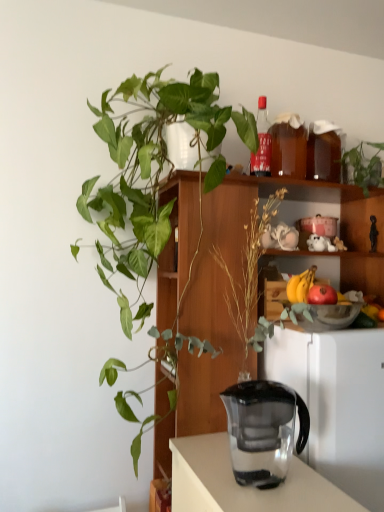
Locate an element on the screen. The width and height of the screenshot is (384, 512). green leafy plant at upper right, which ranks as the 1th houseplant in right-to-left order is located at coordinates (364, 166).

The image size is (384, 512). What do you see at coordinates (153, 185) in the screenshot? I see `green leafy plant at left, which is counted as the second houseplant, starting from the right` at bounding box center [153, 185].

What do you see at coordinates (300, 285) in the screenshot?
I see `yellow matte bananas at center-right` at bounding box center [300, 285].

Describe the element at coordinates (322, 295) in the screenshot. I see `red matte apple at upper right` at that location.

Locate an element on the screen. Image resolution: width=384 pixels, height=512 pixels. green leafy plant at upper right, which ranks as the 1th houseplant in right-to-left order is located at coordinates (364, 166).

Would you consider green leafy plant at upper right, which ranks as the 1th houseplant in right-to-left order, to be distant from translucent glass bowl at upper right?

Actually, green leafy plant at upper right, which ranks as the 1th houseplant in right-to-left order, and translucent glass bowl at upper right are a little close together.

Is green leafy plant at upper right, which ranks as the 2th houseplant in left-to-right order, taller or shorter than translucent glass bowl at upper right?

Considering their sizes, green leafy plant at upper right, which ranks as the 2th houseplant in left-to-right order, has more height than translucent glass bowl at upper right.

From the image's perspective, between green leafy plant at upper right, which ranks as the 2th houseplant in left-to-right order, and translucent glass bowl at upper right, who is located below?

translucent glass bowl at upper right, from the image's perspective.

Considering the points (359, 153) and (349, 305), which point is behind, point (359, 153) or point (349, 305)?

The point (359, 153) is more distant.

Considering the sizes of objects yellow matte bananas at center-right and transparent plastic jug at center in the image provided, who is smaller, yellow matte bananas at center-right or transparent plastic jug at center?

yellow matte bananas at center-right.

Choose the correct answer: Is yellow matte bananas at center-right inside transparent plastic jug at center or outside it?

yellow matte bananas at center-right cannot be found inside transparent plastic jug at center.

Considering the relative sizes of yellow matte bananas at center-right and transparent plastic jug at center in the image provided, is yellow matte bananas at center-right shorter than transparent plastic jug at center?

Yes, yellow matte bananas at center-right is shorter than transparent plastic jug at center.

Is point (292, 287) behind point (238, 403)?

Yes, it is behind point (238, 403).

Which object is positioned more to the left, wooden bookshelf at center or transparent plastic pitcher at lower center?

Positioned to the left is wooden bookshelf at center.

Between wooden bookshelf at center and transparent plastic pitcher at lower center, which one has larger width?

With larger width is transparent plastic pitcher at lower center.

You are a GUI agent. You are given a task and a screenshot of the screen. Output one action in this format:
    pyautogui.click(x=<x>, y=<y>)
    Task: Click on the appliance on the right of wooden bookshelf at center
    
    Given the screenshot: What is the action you would take?
    pyautogui.click(x=337, y=402)

From the image's perspective, relative to transparent plastic pitcher at lower center, is wooden bookshelf at center above or below?

From the image's perspective, wooden bookshelf at center appears above transparent plastic pitcher at lower center.

Is green leafy plant at upper right, which ranks as the 1th houseplant in right-to-left order, positioned before wooden bookshelf at center?

That is False.

Is green leafy plant at upper right, which ranks as the 2th houseplant in left-to-right order, not near wooden bookshelf at center?

No, green leafy plant at upper right, which ranks as the 2th houseplant in left-to-right order, is in close proximity to wooden bookshelf at center.

The height and width of the screenshot is (512, 384). In order to click on bookshelf that appears below the green leafy plant at upper right, which ranks as the 2th houseplant in left-to-right order (from a real-world perspective) in this screenshot , I will do `click(241, 282)`.

Is green leafy plant at upper right, which ranks as the 2th houseplant in left-to-right order, bigger than wooden bookshelf at center?

No, green leafy plant at upper right, which ranks as the 2th houseplant in left-to-right order, is not bigger than wooden bookshelf at center.

Does yellow matte bananas at center-right have a greater height compared to red matte apple at upper right?

Yes.

Considering the relative sizes of yellow matte bananas at center-right and red matte apple at upper right in the image provided, is yellow matte bananas at center-right smaller than red matte apple at upper right?

Actually, yellow matte bananas at center-right might be larger than red matte apple at upper right.

Does yellow matte bananas at center-right have a greater width compared to red matte apple at upper right?

No, yellow matte bananas at center-right is not wider than red matte apple at upper right.

Identify the location of banana above the red matte apple at upper right (from the image's perspective). (300, 285).

From a real-world perspective, relative to transparent plastic pitcher at lower center, is translucent glass bowl at upper right vertically above or below?

In terms of real-world spatial position, translucent glass bowl at upper right is above transparent plastic pitcher at lower center.

Identify the location of bowl above the transparent plastic pitcher at lower center (from the image's perspective). (329, 316).

What's the angular difference between translucent glass bowl at upper right and transparent plastic pitcher at lower center's facing directions?

translucent glass bowl at upper right and transparent plastic pitcher at lower center are facing 0.953 degrees away from each other.

Which is behind, translucent glass bowl at upper right or transparent plastic pitcher at lower center?

translucent glass bowl at upper right is further away from the camera.

Is the depth of yellow matte bananas at center-right less than that of green leafy plant at upper right, which ranks as the 2th houseplant in left-to-right order?

Yes, it is in front of green leafy plant at upper right, which ranks as the 2th houseplant in left-to-right order.

Could you tell me if yellow matte bananas at center-right is turned towards green leafy plant at upper right, which ranks as the 2th houseplant in left-to-right order?

No, yellow matte bananas at center-right does not turn towards green leafy plant at upper right, which ranks as the 2th houseplant in left-to-right order.

Considering the relative sizes of yellow matte bananas at center-right and green leafy plant at upper right, which ranks as the 2th houseplant in left-to-right order, in the image provided, is yellow matte bananas at center-right shorter than green leafy plant at upper right, which ranks as the 2th houseplant in left-to-right order,?

Indeed, yellow matte bananas at center-right has a lesser height compared to green leafy plant at upper right, which ranks as the 2th houseplant in left-to-right order.

From the image's perspective, is yellow matte bananas at center-right under green leafy plant at upper right, which ranks as the 2th houseplant in left-to-right order?

Indeed, from the image's perspective, yellow matte bananas at center-right is shown beneath green leafy plant at upper right, which ranks as the 2th houseplant in left-to-right order.

In order to click on bowl that appears below the green leafy plant at upper right, which ranks as the 1th houseplant in right-to-left order (from the image's perspective) in this screenshot , I will do `click(329, 316)`.

This screenshot has height=512, width=384. In order to click on banana on the right of transparent plastic jug at center in this screenshot , I will do `click(300, 285)`.

Looking at the image, which one is located closer to translucent glass bowl at upper right, translucent glass bottle at upper center or green leafy plant at upper right, which ranks as the 2th houseplant in left-to-right order?

Among the two, translucent glass bottle at upper center is located nearer to translucent glass bowl at upper right.

When comparing their distances from green leafy plant at left, which is the 1th houseplant in left-to-right order, does wooden bookshelf at center or yellow matte bananas at center-right seem further?

yellow matte bananas at center-right is positioned further to the anchor green leafy plant at left, which is the 1th houseplant in left-to-right order.

Which object lies further to the anchor point green leafy plant at upper right, which ranks as the 2th houseplant in left-to-right order, translucent glass bottle at upper center or red matte apple at upper right?

The object further to green leafy plant at upper right, which ranks as the 2th houseplant in left-to-right order, is red matte apple at upper right.

Estimate the real-world distances between objects in this image. Which object is further from wooden bookshelf at center, translucent glass bowl at upper right or yellow matte bananas at center-right?

translucent glass bowl at upper right is positioned further to the anchor wooden bookshelf at center.

From the image, which object appears to be farther from green leafy plant at left, which is counted as the second houseplant, starting from the right, green leafy plant at upper right, which ranks as the 2th houseplant in left-to-right order, or transparent plastic pitcher at lower center?

Based on the image, green leafy plant at upper right, which ranks as the 2th houseplant in left-to-right order, appears to be further to green leafy plant at left, which is counted as the second houseplant, starting from the right.

Considering their positions, is red matte apple at upper right positioned further to transparent plastic pitcher at lower center than green leafy plant at upper right, which ranks as the 1th houseplant in right-to-left order?

Based on the image, green leafy plant at upper right, which ranks as the 1th houseplant in right-to-left order, appears to be further to transparent plastic pitcher at lower center.

Looking at the image, which one is located closer to transparent plastic pitcher at lower center, translucent glass bowl at upper right or red matte apple at upper right?

The object closer to transparent plastic pitcher at lower center is translucent glass bowl at upper right.

Looking at the image, which one is located closer to translucent glass bowl at upper right, yellow matte bananas at center-right or green leafy plant at upper right, which ranks as the 1th houseplant in right-to-left order?

The object closer to translucent glass bowl at upper right is yellow matte bananas at center-right.

You are a GUI agent. You are given a task and a screenshot of the screen. Output one action in this format:
    pyautogui.click(x=<x>, y=<y>)
    Task: Click on the apple between green leafy plant at left, which is the 1th houseplant in left-to-right order, and transparent plastic pitcher at lower center, in the vertical direction
    
    Given the screenshot: What is the action you would take?
    pyautogui.click(x=322, y=295)

At what (x,y) coordinates should I click in order to perform the action: click on bookshelf between green leafy plant at left, which is counted as the second houseplant, starting from the right, and transparent plastic jug at center in the up-down direction. Please return your answer as a coordinate pair (x, y). The height and width of the screenshot is (512, 384). Looking at the image, I should click on (241, 282).

Image resolution: width=384 pixels, height=512 pixels. I want to click on apple that lies between green leafy plant at upper right, which ranks as the 2th houseplant in left-to-right order, and translucent glass bowl at upper right from top to bottom, so click(x=322, y=295).

Identify the location of bowl between green leafy plant at left, which is the 1th houseplant in left-to-right order, and green leafy plant at upper right, which ranks as the 2th houseplant in left-to-right order, in the horizontal direction. Image resolution: width=384 pixels, height=512 pixels. (329, 316).